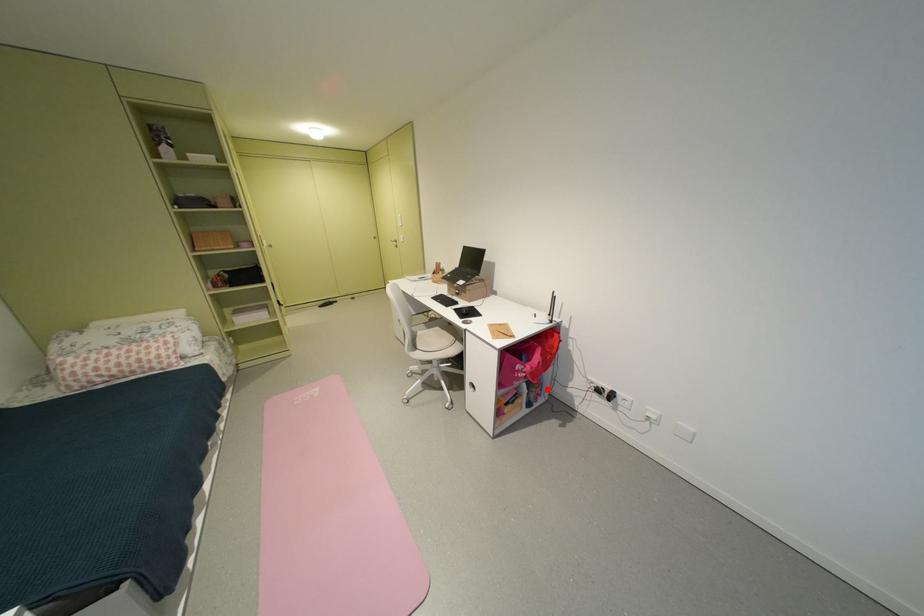
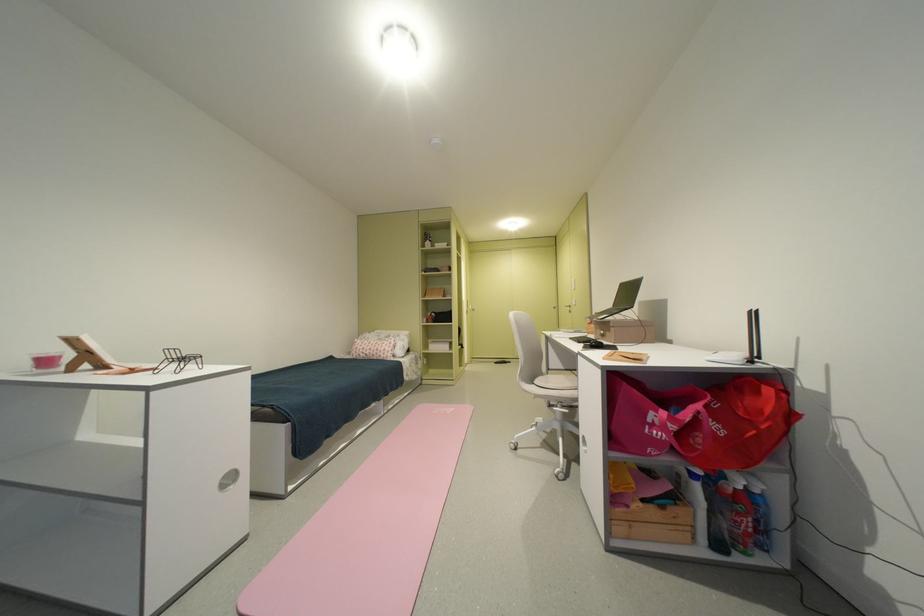
Where in the second image is the point corresponding to the highlighted location from the first image?

(755, 519)